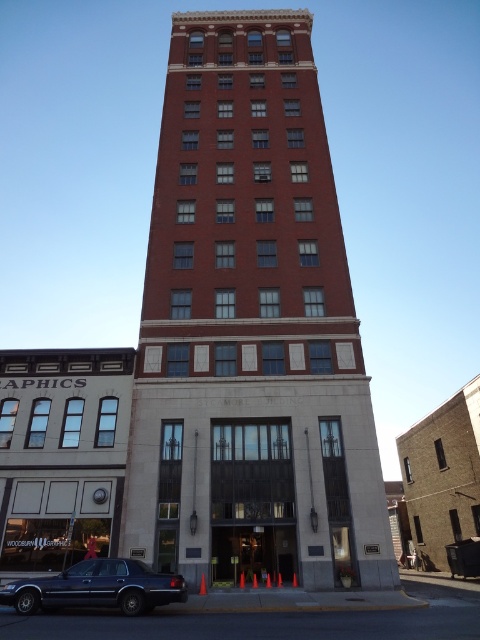
In the scene shown: Between red brick building at center and metallic silver clock at center, which one is positioned higher?

red brick building at center is above.

Locate an element on the screen. red brick building at center is located at coordinates (251, 326).

Is red brick building at center bigger than shiny dark blue sedan at lower left?

Indeed, red brick building at center has a larger size compared to shiny dark blue sedan at lower left.

The image size is (480, 640). In order to click on red brick building at center in this screenshot , I will do `click(251, 326)`.

At what (x,y) coordinates should I click in order to perform the action: click on red brick building at center. Please return your answer as a coordinate pair (x, y). Looking at the image, I should click on (251, 326).

Does shiny dark blue sedan at lower left appear under metallic silver clock at center?

Correct, shiny dark blue sedan at lower left is located below metallic silver clock at center.

How distant is shiny dark blue sedan at lower left from metallic silver clock at center?

A distance of 19.99 feet exists between shiny dark blue sedan at lower left and metallic silver clock at center.

Is point (93, 604) positioned before point (101, 497)?

Yes, point (93, 604) is closer to viewer.

Identify the location of shiny dark blue sedan at lower left. (96, 588).